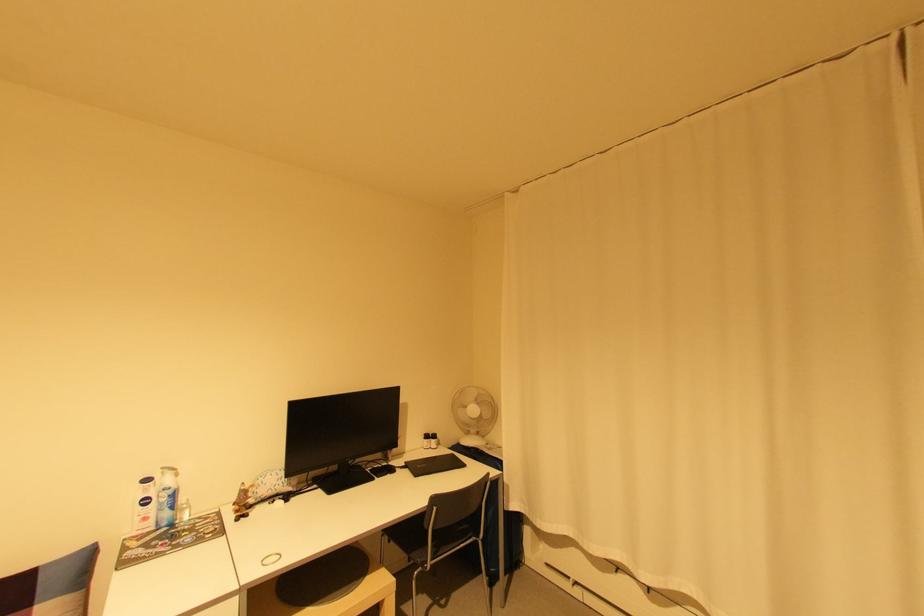
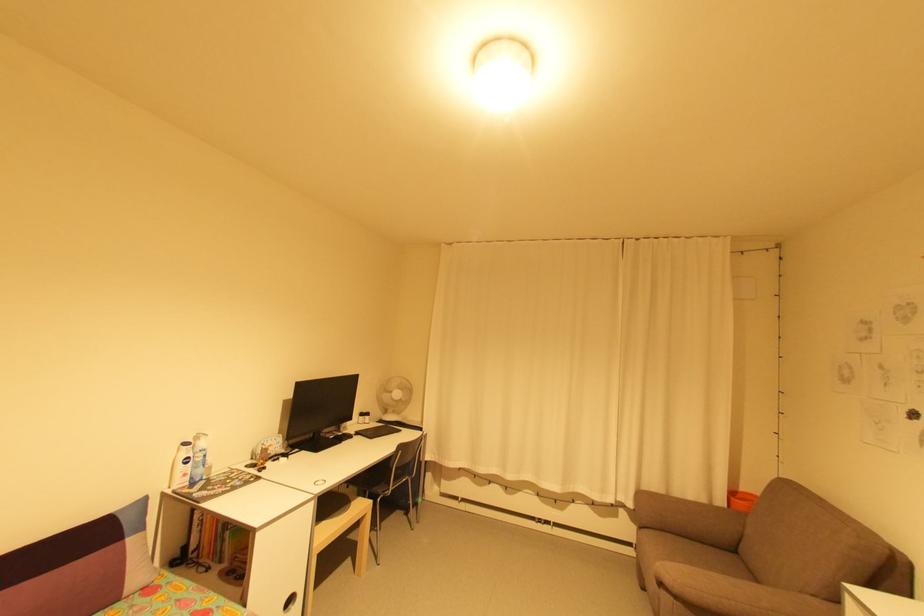
Which direction would the cameraman need to move to produce the second image?

The cameraman walked toward left, backward.